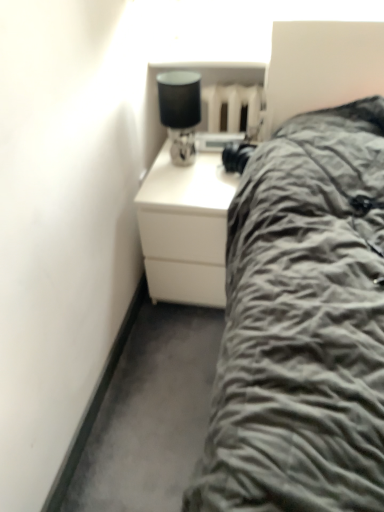
The height and width of the screenshot is (512, 384). Find the location of `vacant space situated above white matte chest of drawers at center (from a real-world perspective)`. vacant space situated above white matte chest of drawers at center (from a real-world perspective) is located at coordinates (210, 155).